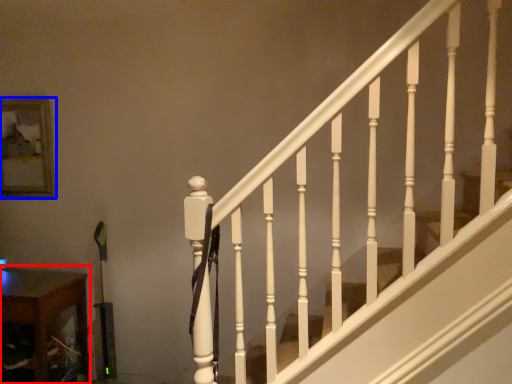
Question: Which of the following is the farthest to the observer, table (highlighted by a red box) or picture frame (highlighted by a blue box)?

Choices:
 (A) table
 (B) picture frame

Answer: (B)